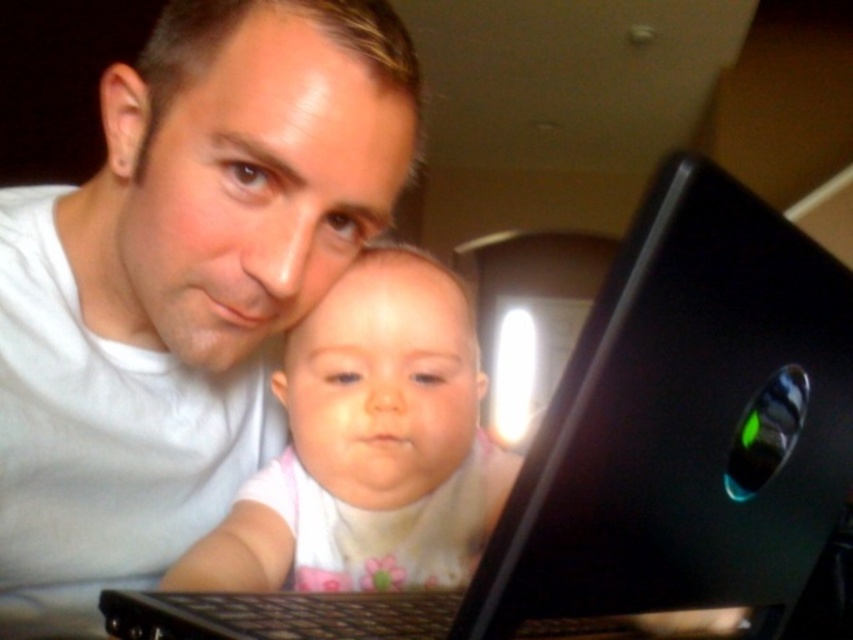
You are a photographer setting up a shoot in the scene described. You need to place a new camera stand that is 1 meter wide between the black glossy laptop at center and the smooth white baby at center. Given their widths, will the stand fit comfortably between them without overlapping either object?

The black glossy laptop at center has a larger width than the smooth white baby at center. However, the question is about fitting a 1 meter wide camera stand between them. Since the description only provides relative size information between the two objects but does not specify their actual widths or the distance between them, it is impossible to determine if the 1 meter wide stand will fit comfortably between them based on the given information.

You are trying to place a new photo frame on the desk in the scene. The photo frame is 15 cm wide. Can the black glossy laptop at center fit on the desk along with the photo frame without overlapping?

The black glossy laptop at center is located at point (645, 454), but without knowing the desk dimensions or the photo frame placement, it is impossible to determine if they can fit together without overlapping.

What is the object located at the coordinates point (183,282)?

The object located at point (183,282) is the white matte shirt at center.